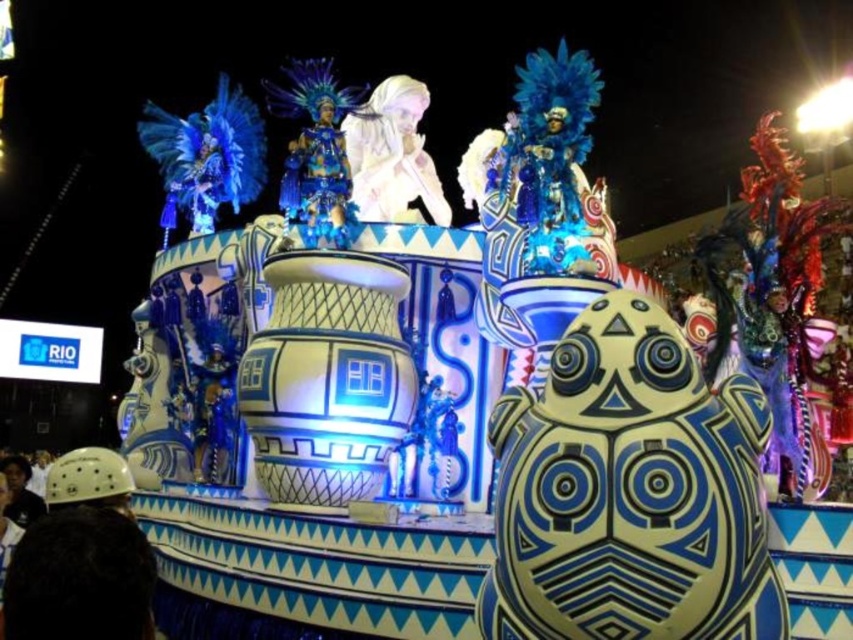
Does white matte hair at upper center have a greater width compared to shiny blue costume at center?

Yes.

Can you confirm if white matte hair at upper center is bigger than shiny blue costume at center?

Yes, white matte hair at upper center is bigger than shiny blue costume at center.

The width and height of the screenshot is (853, 640). I want to click on white matte hair at upper center, so click(392, 156).

I want to click on white matte hair at upper center, so pyautogui.click(x=392, y=156).